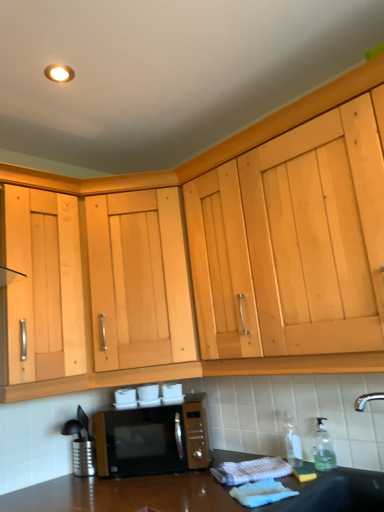
I want to click on transparent plastic soap dispenser at lower right, acting as the 2th bottle starting from the left, so click(x=323, y=448).

This screenshot has width=384, height=512. Describe the element at coordinates (292, 440) in the screenshot. I see `clear glass bottle at lower right, the second bottle viewed from the right` at that location.

The width and height of the screenshot is (384, 512). What do you see at coordinates (338, 492) in the screenshot?
I see `black matte sink at lower right` at bounding box center [338, 492].

Locate an element on the screen. The width and height of the screenshot is (384, 512). matte black microwave at lower center is located at coordinates (154, 438).

Identify the location of light wood cabinet at center. Image resolution: width=384 pixels, height=512 pixels. (139, 280).

Where is `transparent plastic soap dispenser at lower right, acting as the 2th bottle starting from the left`? transparent plastic soap dispenser at lower right, acting as the 2th bottle starting from the left is located at coordinates (323, 448).

Looking at this image, from a real-world perspective, is clear glass bottle at lower right, the 1th bottle positioned from the left, positioned under transparent plastic soap dispenser at lower right, acting as the 2th bottle starting from the left, based on gravity?

Incorrect, from a real-world perspective, clear glass bottle at lower right, the 1th bottle positioned from the left, is higher than transparent plastic soap dispenser at lower right, acting as the 2th bottle starting from the left.

Can you confirm if clear glass bottle at lower right, the second bottle viewed from the right, is taller than transparent plastic soap dispenser at lower right, the first bottle when ordered from right to left?

Correct, clear glass bottle at lower right, the second bottle viewed from the right, is much taller as transparent plastic soap dispenser at lower right, the first bottle when ordered from right to left.

Based on the photo, from the image's perspective, is clear glass bottle at lower right, the second bottle viewed from the right, under transparent plastic soap dispenser at lower right, acting as the 2th bottle starting from the left?

Indeed, from the image's perspective, clear glass bottle at lower right, the second bottle viewed from the right, is shown beneath transparent plastic soap dispenser at lower right, acting as the 2th bottle starting from the left.

Are clear glass bottle at lower right, the second bottle viewed from the right, and transparent plastic soap dispenser at lower right, the first bottle when ordered from right to left, located far from each other?

No.

Considering their positions, is black matte sink at lower right located in front of or behind light wood cabinet at center?

black matte sink at lower right is positioned closer to the viewer than light wood cabinet at center.

From the image's perspective, is black matte sink at lower right located above light wood cabinet at center?

No, from the image's perspective, black matte sink at lower right is not on top of light wood cabinet at center.

Which object is positioned more to the left, black matte sink at lower right or light wood cabinet at center?

light wood cabinet at center is more to the left.

Locate an element on the screen. The image size is (384, 512). sink to the right of matte black microwave at lower center is located at coordinates (338, 492).

From the image's perspective, which object appears higher, matte black microwave at lower center or black matte sink at lower right?

black matte sink at lower right is shown above in the image.

Could you tell me if matte black microwave at lower center is turned towards black matte sink at lower right?

No, matte black microwave at lower center is not aimed at black matte sink at lower right.

Where is `the 2nd bottle below the matte black microwave at lower center (from a real-world perspective)`? The width and height of the screenshot is (384, 512). the 2nd bottle below the matte black microwave at lower center (from a real-world perspective) is located at coordinates (323, 448).

Who is smaller, matte black microwave at lower center or transparent plastic soap dispenser at lower right, the first bottle when ordered from right to left?

transparent plastic soap dispenser at lower right, the first bottle when ordered from right to left.

Consider the image. Choose the correct answer: Is matte black microwave at lower center inside transparent plastic soap dispenser at lower right, acting as the 2th bottle starting from the left, or outside it?

matte black microwave at lower center is spatially situated outside transparent plastic soap dispenser at lower right, acting as the 2th bottle starting from the left.

Is matte black microwave at lower center facing away from transparent plastic soap dispenser at lower right, the first bottle when ordered from right to left?

matte black microwave at lower center is not turned away from transparent plastic soap dispenser at lower right, the first bottle when ordered from right to left.

Which object is positioned more to the left, black matte sink at lower right or transparent plastic soap dispenser at lower right, acting as the 2th bottle starting from the left?

black matte sink at lower right.

Which object is further away from the camera taking this photo, black matte sink at lower right or transparent plastic soap dispenser at lower right, acting as the 2th bottle starting from the left?

Positioned behind is transparent plastic soap dispenser at lower right, acting as the 2th bottle starting from the left.

Between black matte sink at lower right and transparent plastic soap dispenser at lower right, acting as the 2th bottle starting from the left, which one has larger width?

black matte sink at lower right is wider.

Which of these two, black matte sink at lower right or transparent plastic soap dispenser at lower right, the first bottle when ordered from right to left, is smaller?

Smaller between the two is transparent plastic soap dispenser at lower right, the first bottle when ordered from right to left.

Does transparent plastic soap dispenser at lower right, the first bottle when ordered from right to left, have a lesser width compared to clear glass bottle at lower right, the second bottle viewed from the right?

Yes.

Is transparent plastic soap dispenser at lower right, the first bottle when ordered from right to left, oriented towards clear glass bottle at lower right, the second bottle viewed from the right?

No.

Who is shorter, transparent plastic soap dispenser at lower right, the first bottle when ordered from right to left, or clear glass bottle at lower right, the 1th bottle positioned from the left?

Standing shorter between the two is transparent plastic soap dispenser at lower right, the first bottle when ordered from right to left.

What's the angular difference between transparent plastic soap dispenser at lower right, acting as the 2th bottle starting from the left, and clear glass bottle at lower right, the 1th bottle positioned from the left,'s facing directions?

The facing directions of transparent plastic soap dispenser at lower right, acting as the 2th bottle starting from the left, and clear glass bottle at lower right, the 1th bottle positioned from the left, are 5 degrees apart.

Is light wood cabinet at center aimed at clear glass bottle at lower right, the 1th bottle positioned from the left?

No, light wood cabinet at center is not facing towards clear glass bottle at lower right, the 1th bottle positioned from the left.

Based on the photo, from the image's perspective, is light wood cabinet at center located beneath clear glass bottle at lower right, the 1th bottle positioned from the left?

Incorrect, from the image's perspective, light wood cabinet at center is higher than clear glass bottle at lower right, the 1th bottle positioned from the left.

Are light wood cabinet at center and clear glass bottle at lower right, the 1th bottle positioned from the left, beside each other?

No, light wood cabinet at center is not with clear glass bottle at lower right, the 1th bottle positioned from the left.

Which is behind, point (119, 343) or point (288, 459)?

The point (119, 343) is farther from the camera.

At what (x,y) coordinates should I click in order to perform the action: click on bottle behind the transparent plastic soap dispenser at lower right, the first bottle when ordered from right to left. Please return your answer as a coordinate pair (x, y). Image resolution: width=384 pixels, height=512 pixels. Looking at the image, I should click on (292, 440).

You are a GUI agent. You are given a task and a screenshot of the screen. Output one action in this format:
    pyautogui.click(x=<x>, y=<y>)
    Task: Click on the sink that appears below the light wood cabinet at center (from the image's perspective)
    The width and height of the screenshot is (384, 512).
    Given the screenshot: What is the action you would take?
    pyautogui.click(x=338, y=492)

Looking at this image, from the image, which object appears to be farther from transparent plastic soap dispenser at lower right, the first bottle when ordered from right to left, light wood cabinet at center or matte black microwave at lower center?

light wood cabinet at center.

Considering their positions, is matte black microwave at lower center positioned further to transparent plastic soap dispenser at lower right, acting as the 2th bottle starting from the left, than black matte sink at lower right?

matte black microwave at lower center is positioned further to the anchor transparent plastic soap dispenser at lower right, acting as the 2th bottle starting from the left.

Considering their positions, is light wood cabinet at center positioned closer to clear glass bottle at lower right, the 1th bottle positioned from the left, than transparent plastic soap dispenser at lower right, the first bottle when ordered from right to left?

Based on the image, transparent plastic soap dispenser at lower right, the first bottle when ordered from right to left, appears to be nearer to clear glass bottle at lower right, the 1th bottle positioned from the left.

Estimate the real-world distances between objects in this image. Which object is closer to clear glass bottle at lower right, the second bottle viewed from the right, light wood cabinet at center or matte black microwave at lower center?

matte black microwave at lower center is closer to clear glass bottle at lower right, the second bottle viewed from the right.

Considering their positions, is transparent plastic soap dispenser at lower right, the first bottle when ordered from right to left, positioned further to matte black microwave at lower center than light wood cabinet at center?

transparent plastic soap dispenser at lower right, the first bottle when ordered from right to left, is positioned further to the anchor matte black microwave at lower center.

When comparing their distances from clear glass bottle at lower right, the second bottle viewed from the right, does transparent plastic soap dispenser at lower right, acting as the 2th bottle starting from the left, or matte black microwave at lower center seem closer?

transparent plastic soap dispenser at lower right, acting as the 2th bottle starting from the left, lies closer to clear glass bottle at lower right, the second bottle viewed from the right, than the other object.

From the image, which object appears to be farther from clear glass bottle at lower right, the second bottle viewed from the right, matte black microwave at lower center or light wood cabinet at center?

light wood cabinet at center is positioned further to the anchor clear glass bottle at lower right, the second bottle viewed from the right.

From the picture: Considering their positions, is black matte sink at lower right positioned closer to transparent plastic soap dispenser at lower right, the first bottle when ordered from right to left, than light wood cabinet at center?

The object closer to transparent plastic soap dispenser at lower right, the first bottle when ordered from right to left, is black matte sink at lower right.

Where is `bottle between black matte sink at lower right and clear glass bottle at lower right, the second bottle viewed from the right, from front to back`? bottle between black matte sink at lower right and clear glass bottle at lower right, the second bottle viewed from the right, from front to back is located at coordinates (323, 448).

Where is `microwave oven between light wood cabinet at center and transparent plastic soap dispenser at lower right, the first bottle when ordered from right to left, from left to right`? This screenshot has height=512, width=384. microwave oven between light wood cabinet at center and transparent plastic soap dispenser at lower right, the first bottle when ordered from right to left, from left to right is located at coordinates (154, 438).

Locate an element on the screen. Image resolution: width=384 pixels, height=512 pixels. cabinetry located between black matte sink at lower right and matte black microwave at lower center in the depth direction is located at coordinates (139, 280).

This screenshot has width=384, height=512. Find the location of `bottle between matte black microwave at lower center and transparent plastic soap dispenser at lower right, the first bottle when ordered from right to left, in the horizontal direction`. bottle between matte black microwave at lower center and transparent plastic soap dispenser at lower right, the first bottle when ordered from right to left, in the horizontal direction is located at coordinates point(292,440).